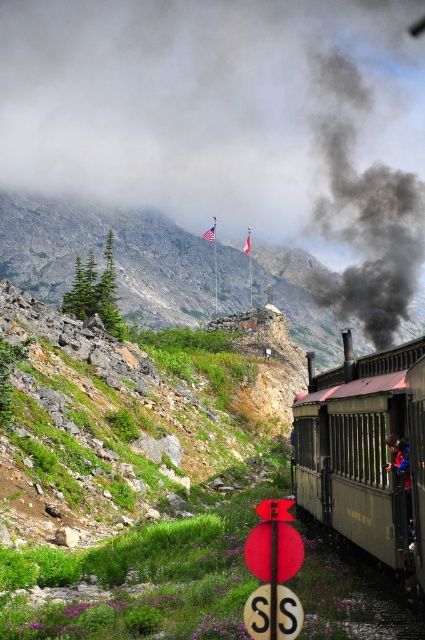
Is matte black train at right positioned behind black smoke at upper center?

No, matte black train at right is closer to the viewer.

Consider the image. Which is above, matte black train at right or black smoke at upper center?

black smoke at upper center

Who is more distant from viewer, (329, 488) or (379, 332)?

Positioned behind is point (379, 332).

Where is `matte black train at right`? matte black train at right is located at coordinates (365, 452).

Between rugged stone mountain at upper center and matte black train at right, which one is positioned lower?

matte black train at right is below.

Who is shorter, rugged stone mountain at upper center or matte black train at right?

With less height is matte black train at right.

Is point (124, 310) farther from viewer compared to point (373, 372)?

Yes, point (124, 310) is behind point (373, 372).

Locate an element on the screen. rugged stone mountain at upper center is located at coordinates (102, 259).

Between rugged stone mountain at upper center and black smoke at upper center, which one appears on the left side from the viewer's perspective?

From the viewer's perspective, rugged stone mountain at upper center appears more on the left side.

Between rugged stone mountain at upper center and black smoke at upper center, which one is positioned higher?

Positioned higher is black smoke at upper center.

Find the location of `rugged stone mountain at upper center`. rugged stone mountain at upper center is located at coordinates (102, 259).